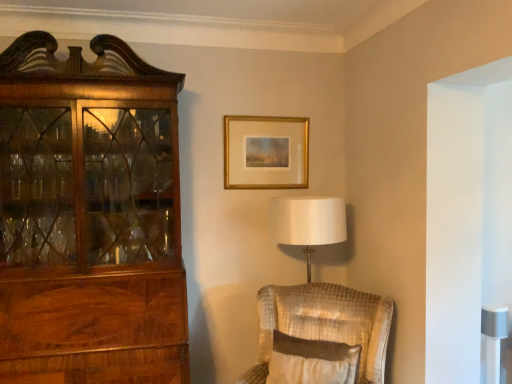
Question: From a real-world perspective, is white textured pillow at center positioned over velvet beige chair at lower right based on gravity?

Choices:
 (A) yes
 (B) no

Answer: (A)

Question: From the image's perspective, is white textured pillow at center above velvet beige chair at lower right?

Choices:
 (A) no
 (B) yes

Answer: (A)

Question: Does white textured pillow at center have a smaller size compared to velvet beige chair at lower right?

Choices:
 (A) no
 (B) yes

Answer: (B)

Question: Considering the relative sizes of white textured pillow at center and velvet beige chair at lower right in the image provided, is white textured pillow at center thinner than velvet beige chair at lower right?

Choices:
 (A) yes
 (B) no

Answer: (A)

Question: Is velvet beige chair at lower right completely or partially inside white textured pillow at center?

Choices:
 (A) yes
 (B) no

Answer: (B)

Question: Is velvet beige chair at lower right wider or thinner than white textured pillow at center?

Choices:
 (A) wide
 (B) thin

Answer: (A)

Question: From a real-world perspective, is velvet beige chair at lower right positioned above or below white textured pillow at center?

Choices:
 (A) below
 (B) above

Answer: (A)

Question: From the image's perspective, is velvet beige chair at lower right located above or below white textured pillow at center?

Choices:
 (A) above
 (B) below

Answer: (A)

Question: Is velvet beige chair at lower right spatially inside white textured pillow at center, or outside of it?

Choices:
 (A) outside
 (B) inside

Answer: (A)

Question: From their relative heights in the image, would you say white textured pillow at center is taller or shorter than gold metallic picture frame at upper center?

Choices:
 (A) tall
 (B) short

Answer: (B)

Question: From the image's perspective, is white textured pillow at center positioned above or below gold metallic picture frame at upper center?

Choices:
 (A) above
 (B) below

Answer: (B)

Question: Looking at their shapes, would you say white textured pillow at center is wider or thinner than gold metallic picture frame at upper center?

Choices:
 (A) thin
 (B) wide

Answer: (B)

Question: Is point (315, 360) positioned closer to the camera than point (276, 168)?

Choices:
 (A) closer
 (B) farther

Answer: (A)

Question: In terms of width, does velvet beige chair at lower right look wider or thinner when compared to gold metallic picture frame at upper center?

Choices:
 (A) thin
 (B) wide

Answer: (B)

Question: Is point (276, 322) closer or farther from the camera than point (247, 137)?

Choices:
 (A) farther
 (B) closer

Answer: (B)